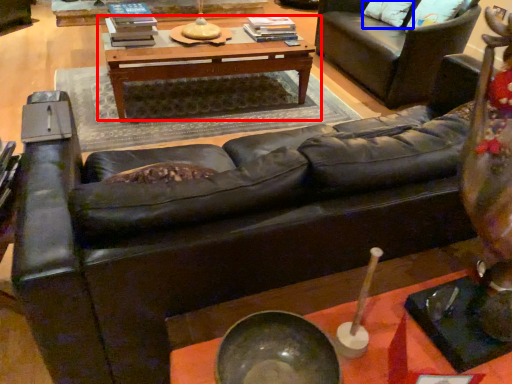
Question: Which object appears closest to the camera in this image, table (highlighted by a red box) or pillow (highlighted by a blue box)?

Choices:
 (A) table
 (B) pillow

Answer: (A)